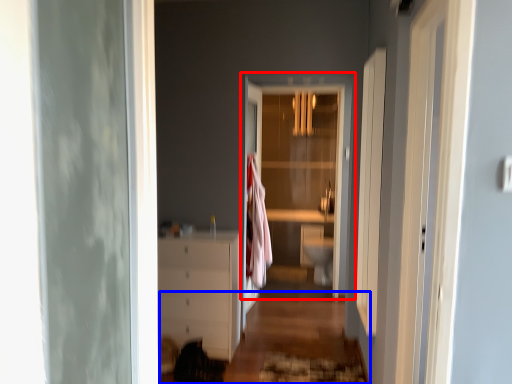
Question: Among these objects, which one is nearest to the camera, door (highlighted by a red box) or path (highlighted by a blue box)?

Choices:
 (A) door
 (B) path

Answer: (B)